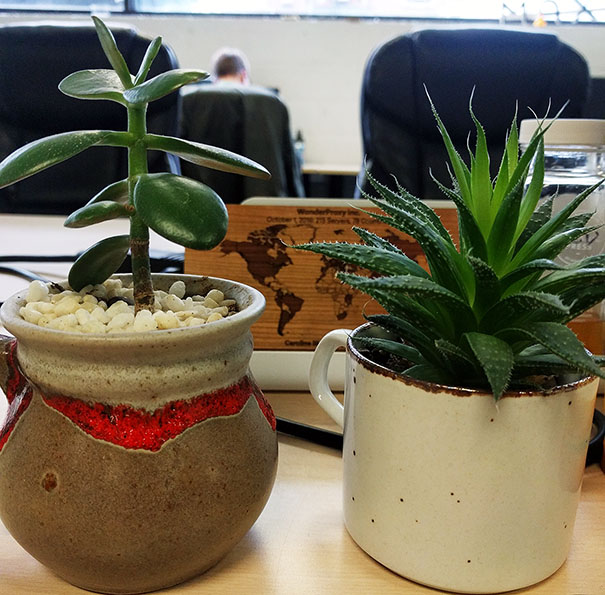
Locate an element on the screen. This screenshot has width=605, height=595. window is located at coordinates (105, 0), (218, 7), (420, 11).